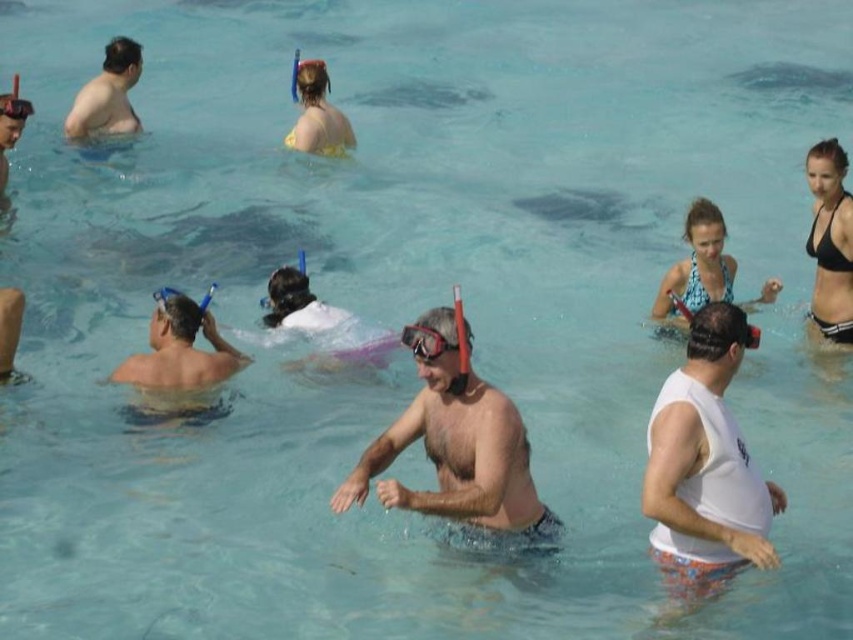
Is smooth skin man at left taller than matte skin at upper left?

In fact, smooth skin man at left may be shorter than matte skin at upper left.

Who is positioned more to the left, smooth skin man at left or matte skin at upper left?

From the viewer's perspective, matte skin at upper left appears more on the left side.

Who is more distant from viewer, (202, 324) or (109, 72)?

Point (109, 72)

Where is `smooth skin man at left`? The width and height of the screenshot is (853, 640). smooth skin man at left is located at coordinates [178, 349].

Is black bikini at right below transparent plastic goggles at upper center?

Yes.

Between black bikini at right and transparent plastic goggles at upper center, which one appears on the right side from the viewer's perspective?

From the viewer's perspective, black bikini at right appears more on the right side.

Does point (828, 205) come behind point (15, 102)?

That is False.

I want to click on black bikini at right, so click(x=830, y=243).

Does smooth skin man at center have a lesser height compared to smooth skin man at left?

No.

Looking at this image, is smooth skin man at center closer to the viewer compared to smooth skin man at left?

Yes, it is in front of smooth skin man at left.

Who is more distant from viewer, (430, 310) or (178, 314)?

Positioned behind is point (178, 314).

The height and width of the screenshot is (640, 853). What are the coordinates of `smooth skin man at center` in the screenshot? It's located at (459, 458).